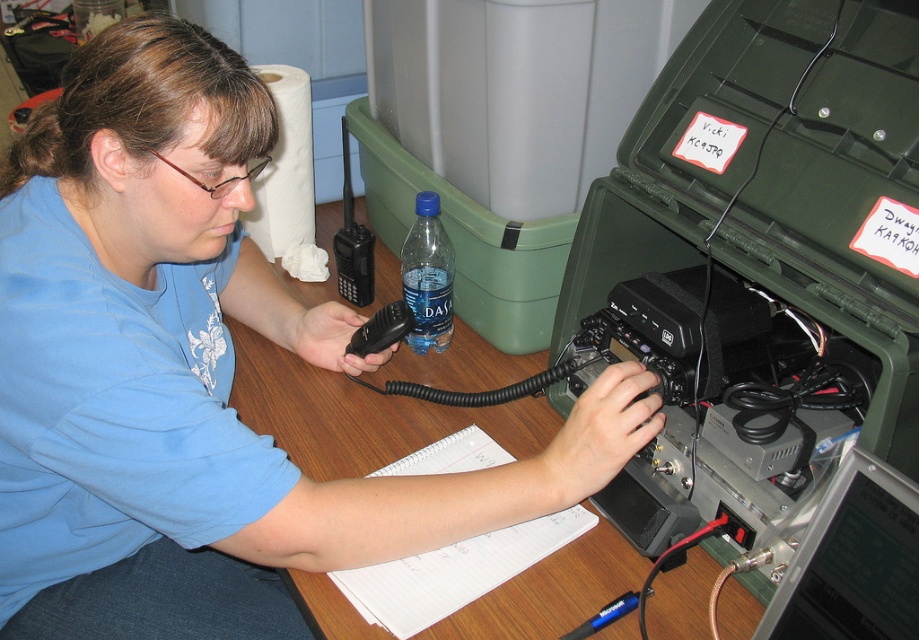
Question: Which is farther from the black plastic walkie-talkie at upper left?

Choices:
 (A) black plastic handheld radio at center
 (B) blue plastic bottle at center
 (C) wooden table at center
 (D) matte black radio at center

Answer: (D)

Question: Which point is farther to the camera?

Choices:
 (A) (441, 276)
 (B) (377, 352)
 (C) (338, 460)

Answer: (A)

Question: Where is blue plastic bottle at center located in relation to black plastic handheld radio at center in the image?

Choices:
 (A) above
 (B) below

Answer: (A)

Question: Which of the following is the closest to the observer?

Choices:
 (A) black plastic handheld radio at center
 (B) wooden table at center

Answer: (B)

Question: Does black plastic walkie-talkie at upper left appear on the left side of black plastic handheld radio at center?

Choices:
 (A) no
 (B) yes

Answer: (B)

Question: From the image, what is the correct spatial relationship of wooden table at center in relation to black plastic walkie-talkie at upper left?

Choices:
 (A) left
 (B) right

Answer: (B)